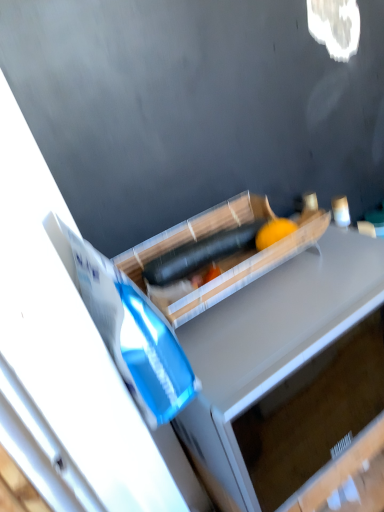
Identify the location of empty space that is ontop of wooden tray at center (from a real-world perspective). Image resolution: width=384 pixels, height=512 pixels. (188, 236).